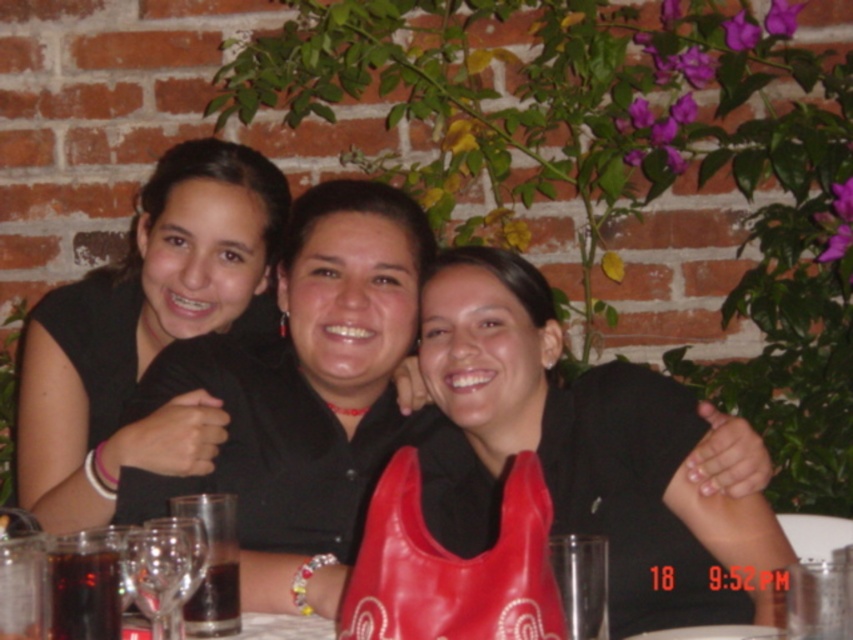
Can you confirm if matte black shirt at center is bigger than black matte shirt at center?

Actually, matte black shirt at center might be smaller than black matte shirt at center.

Is matte black shirt at center thinner than black matte shirt at center?

Incorrect, matte black shirt at center's width is not less than black matte shirt at center's.

Between point (552, 300) and point (155, 236), which one is positioned in front?

Positioned in front is point (552, 300).

At what (x,y) coordinates should I click in order to perform the action: click on matte black shirt at center. Please return your answer as a coordinate pair (x, y). The height and width of the screenshot is (640, 853). Looking at the image, I should click on (570, 445).

Between matte black shirt at center and transparent glass wine glass at center, which one appears on the right side from the viewer's perspective?

Positioned to the right is matte black shirt at center.

Can you confirm if matte black shirt at center is thinner than transparent glass wine glass at center?

No.

Is point (547, 288) closer to camera compared to point (192, 529)?

No, it is not.

Image resolution: width=853 pixels, height=640 pixels. Identify the location of matte black shirt at center. (570, 445).

Is black matte shirt at center closer to camera compared to transparent glass wine glass at center?

No, it is behind transparent glass wine glass at center.

Which is more to the right, black matte shirt at center or transparent glass wine glass at center?

Positioned to the right is transparent glass wine glass at center.

Image resolution: width=853 pixels, height=640 pixels. Find the location of `black matte shirt at center`. black matte shirt at center is located at coordinates (142, 332).